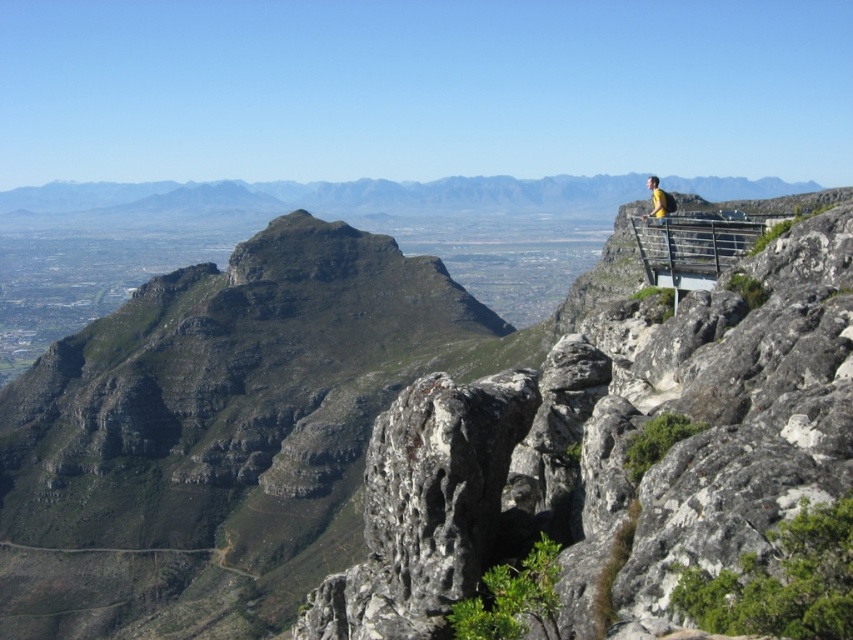
Question: Which object appears closest to the camera in this image?

Choices:
 (A) yellow fabric at upper right
 (B) metallic gray rail at upper right
 (C) rugged rock formation at upper center

Answer: (C)

Question: Is metallic gray rail at upper right above yellow fabric at upper right?

Choices:
 (A) no
 (B) yes

Answer: (A)

Question: Which of the following is the farthest from the observer?

Choices:
 (A) (715, 241)
 (B) (689, 323)

Answer: (A)

Question: Where is rugged rock formation at upper center located in relation to metallic gray rail at upper right in the image?

Choices:
 (A) below
 (B) above

Answer: (A)

Question: Is rugged rock formation at upper center to the right of yellow fabric at upper right from the viewer's perspective?

Choices:
 (A) yes
 (B) no

Answer: (B)

Question: Which point is farther to the camera?

Choices:
 (A) yellow fabric at upper right
 (B) rugged rock formation at upper center

Answer: (A)